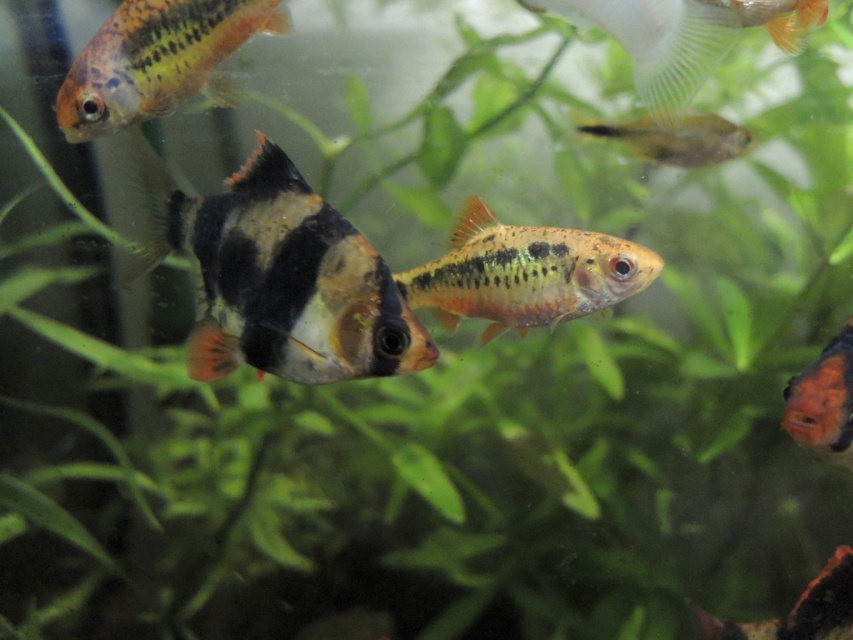
Can you confirm if shiny orange fish at right is positioned to the right of translucent yellowish-green fish at upper right?

Indeed, shiny orange fish at right is positioned on the right side of translucent yellowish-green fish at upper right.

Which is more to the left, shiny orange fish at right or translucent yellowish-green fish at upper right?

From the viewer's perspective, translucent yellowish-green fish at upper right appears more on the left side.

Is point (809, 429) less distant than point (679, 145)?

Yes, it is.

Find the location of a particular element. shiny orange fish at right is located at coordinates (822, 401).

Can you confirm if translucent plastic fin at upper right is positioned to the right of shiny orange fish at right?

Incorrect, translucent plastic fin at upper right is not on the right side of shiny orange fish at right.

Can you confirm if translucent plastic fin at upper right is bigger than shiny orange fish at right?

Yes.

Does point (793, 22) come closer to viewer compared to point (802, 406)?

No, (793, 22) is behind (802, 406).

At what (x,y) coordinates should I click in order to perform the action: click on translucent plastic fin at upper right. Please return your answer as a coordinate pair (x, y). Looking at the image, I should click on (683, 36).

Measure the distance between black and orange fish at center and orange and black striped fish at upper left.

black and orange fish at center is 15.25 inches away from orange and black striped fish at upper left.

Who is more distant from viewer, (x=302, y=321) or (x=189, y=13)?

Point (x=189, y=13)

Locate an element on the screen. This screenshot has height=640, width=853. black and orange fish at center is located at coordinates (277, 276).